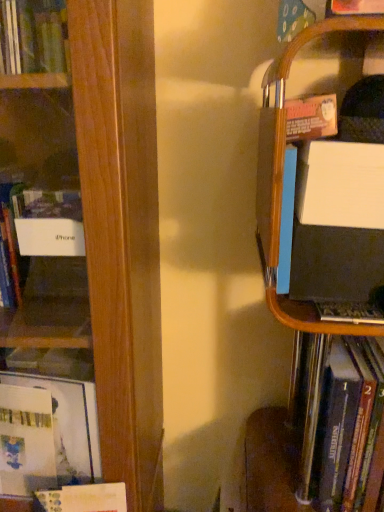
The width and height of the screenshot is (384, 512). I want to click on wooden bookshelf at left, which ranks as the 3th book in right-to-left order, so click(98, 229).

Between black matte laptop at right, which is counted as the first book, starting from the right, and white paper at lower left, the second book viewed from the left, which one has smaller size?

white paper at lower left, the second book viewed from the left.

In the image, there is a black matte laptop at right, acting as the 3th book starting from the left. Where is `book below it (from a real-world perspective)`? The width and height of the screenshot is (384, 512). book below it (from a real-world perspective) is located at coordinates (83, 498).

Is wooden bookshelf at left, which ranks as the 3th book in right-to-left order, wider or thinner than white paper at lower left, the second book viewed from the right?

In the image, wooden bookshelf at left, which ranks as the 3th book in right-to-left order, appears to be wider than white paper at lower left, the second book viewed from the right.

Is wooden bookshelf at left, which ranks as the 3th book in right-to-left order, closer to camera compared to white paper at lower left, the second book viewed from the right?

Yes, wooden bookshelf at left, which ranks as the 3th book in right-to-left order, is in front of white paper at lower left, the second book viewed from the right.

From the image's perspective, is wooden bookshelf at left, which ranks as the first book in left-to-right order, positioned above or below white paper at lower left, the second book viewed from the left?

Clearly, from the image's perspective, wooden bookshelf at left, which ranks as the first book in left-to-right order, is above white paper at lower left, the second book viewed from the left.

In terms of size, does wooden bookshelf at left, which ranks as the 3th book in right-to-left order, appear bigger or smaller than white paper at lower left, the second book viewed from the right?

Clearly, wooden bookshelf at left, which ranks as the 3th book in right-to-left order, is larger in size than white paper at lower left, the second book viewed from the right.

Between point (120, 483) and point (301, 463), which one is positioned behind?

The point (301, 463) is farther from the camera.

Is white paper at lower left, the second book viewed from the right, touching matte black laptop at right?

No, white paper at lower left, the second book viewed from the right, is not in contact with matte black laptop at right.

Is white paper at lower left, the second book viewed from the right, spatially inside matte black laptop at right, or outside of it?

white paper at lower left, the second book viewed from the right, lies outside matte black laptop at right.

Which book is the 1st one when counting from the left side of the black matte laptop at right, acting as the 3th book starting from the left? Please provide its 2D coordinates.

[(83, 498)]

Consider the image. Which object is further away from the camera taking this photo, white paper at lower left, the second book viewed from the left, or black matte laptop at right, which is counted as the first book, starting from the right?

white paper at lower left, the second book viewed from the left, is behind.

Does white paper at lower left, the second book viewed from the right, have a greater height compared to black matte laptop at right, which is counted as the first book, starting from the right?

Incorrect, the height of white paper at lower left, the second book viewed from the right, is not larger of that of black matte laptop at right, which is counted as the first book, starting from the right.

Is wooden bookshelf at left, which ranks as the first book in left-to-right order, positioned beyond the bounds of black matte laptop at right, acting as the 3th book starting from the left?

Yes, wooden bookshelf at left, which ranks as the first book in left-to-right order, is located beyond the bounds of black matte laptop at right, acting as the 3th book starting from the left.

Does wooden bookshelf at left, which ranks as the 3th book in right-to-left order, touch black matte laptop at right, acting as the 3th book starting from the left?

There is a gap between wooden bookshelf at left, which ranks as the 3th book in right-to-left order, and black matte laptop at right, acting as the 3th book starting from the left.

Which object is wider, wooden bookshelf at left, which ranks as the first book in left-to-right order, or black matte laptop at right, acting as the 3th book starting from the left?

wooden bookshelf at left, which ranks as the first book in left-to-right order.

Find the location of a particular element. This screenshot has width=384, height=512. book above the black matte laptop at right, which is counted as the first book, starting from the right (from the image's perspective) is located at coordinates click(x=98, y=229).

Which object is positioned more to the left, wooden bookshelf at left, which ranks as the first book in left-to-right order, or matte black laptop at right?

wooden bookshelf at left, which ranks as the first book in left-to-right order.

From a real-world perspective, which is physically above, wooden bookshelf at left, which ranks as the 3th book in right-to-left order, or matte black laptop at right?

wooden bookshelf at left, which ranks as the 3th book in right-to-left order, is physically above.

Is wooden bookshelf at left, which ranks as the 3th book in right-to-left order, facing away from matte black laptop at right?

wooden bookshelf at left, which ranks as the 3th book in right-to-left order, does not have its back to matte black laptop at right.

Is point (136, 421) closer or farther from the camera than point (280, 202)?

Point (136, 421) is positioned farther from the camera compared to point (280, 202).

Are black matte laptop at right, acting as the 3th book starting from the left, and wooden bookshelf at left, which ranks as the first book in left-to-right order, making contact?

black matte laptop at right, acting as the 3th book starting from the left, and wooden bookshelf at left, which ranks as the first book in left-to-right order, are clearly separated.

Does black matte laptop at right, which is counted as the first book, starting from the right, lie behind wooden bookshelf at left, which ranks as the 3th book in right-to-left order?

Yes, black matte laptop at right, which is counted as the first book, starting from the right, is further from the viewer.

Considering the relative positions of black matte laptop at right, which is counted as the first book, starting from the right, and wooden bookshelf at left, which ranks as the 3th book in right-to-left order, in the image provided, is black matte laptop at right, which is counted as the first book, starting from the right, to the right of wooden bookshelf at left, which ranks as the 3th book in right-to-left order, from the viewer's perspective?

Indeed, black matte laptop at right, which is counted as the first book, starting from the right, is positioned on the right side of wooden bookshelf at left, which ranks as the 3th book in right-to-left order.

Can you confirm if black matte laptop at right, acting as the 3th book starting from the left, is shorter than wooden bookshelf at left, which ranks as the 3th book in right-to-left order?

Indeed, black matte laptop at right, acting as the 3th book starting from the left, has a lesser height compared to wooden bookshelf at left, which ranks as the 3th book in right-to-left order.

Locate an element on the screen. The width and height of the screenshot is (384, 512). book beneath the black matte laptop at right, which is counted as the first book, starting from the right (from a real-world perspective) is located at coordinates [83, 498].

What are the coordinates of `the 1st book to the right of the wooden bookshelf at left, which ranks as the 3th book in right-to-left order, counting from the anchor's position` in the screenshot? It's located at (83, 498).

Based on their spatial positions, is white paper at lower left, the second book viewed from the right, or matte black laptop at right further from black matte laptop at right, acting as the 3th book starting from the left?

Among the two, white paper at lower left, the second book viewed from the right, is located further to black matte laptop at right, acting as the 3th book starting from the left.

Looking at the image, which one is located further to wooden bookshelf at left, which ranks as the 3th book in right-to-left order, matte black laptop at right or black matte laptop at right, acting as the 3th book starting from the left?

black matte laptop at right, acting as the 3th book starting from the left, lies further to wooden bookshelf at left, which ranks as the 3th book in right-to-left order, than the other object.

Which object lies nearer to the anchor point wooden bookshelf at left, which ranks as the first book in left-to-right order, matte black laptop at right or white paper at lower left, the second book viewed from the left?

matte black laptop at right.

When comparing their distances from matte black laptop at right, does wooden bookshelf at left, which ranks as the first book in left-to-right order, or black matte laptop at right, which is counted as the first book, starting from the right, seem closer?

black matte laptop at right, which is counted as the first book, starting from the right, is positioned closer to the anchor matte black laptop at right.

Based on their spatial positions, is white paper at lower left, the second book viewed from the left, or wooden bookshelf at left, which ranks as the 3th book in right-to-left order, closer to matte black laptop at right?

wooden bookshelf at left, which ranks as the 3th book in right-to-left order.

Looking at this image, when comparing their distances from wooden bookshelf at left, which ranks as the 3th book in right-to-left order, does black matte laptop at right, which is counted as the first book, starting from the right, or white paper at lower left, the second book viewed from the left, seem closer?

Based on the image, white paper at lower left, the second book viewed from the left, appears to be nearer to wooden bookshelf at left, which ranks as the 3th book in right-to-left order.

Looking at this image, looking at the image, which one is located further to black matte laptop at right, acting as the 3th book starting from the left, white paper at lower left, the second book viewed from the right, or wooden bookshelf at left, which ranks as the first book in left-to-right order?

Among the two, wooden bookshelf at left, which ranks as the first book in left-to-right order, is located further to black matte laptop at right, acting as the 3th book starting from the left.

Which object lies nearer to the anchor point black matte laptop at right, which is counted as the first book, starting from the right, wooden bookshelf at left, which ranks as the first book in left-to-right order, or matte black laptop at right?

Based on the image, matte black laptop at right appears to be nearer to black matte laptop at right, which is counted as the first book, starting from the right.

At what (x,y) coordinates should I click in order to perform the action: click on book situated between wooden bookshelf at left, which ranks as the 3th book in right-to-left order, and black matte laptop at right, acting as the 3th book starting from the left, from left to right. Please return your answer as a coordinate pair (x, y). This screenshot has width=384, height=512. Looking at the image, I should click on (83, 498).

Identify the location of bookshelf located between white paper at lower left, the second book viewed from the right, and black matte laptop at right, which is counted as the first book, starting from the right, in the left-right direction. (280, 224).

Find the location of a particular element. This screenshot has height=512, width=384. book between wooden bookshelf at left, which ranks as the first book in left-to-right order, and matte black laptop at right, in the horizontal direction is located at coordinates (83, 498).

At what (x,y) coordinates should I click in order to perform the action: click on bookshelf located between wooden bookshelf at left, which ranks as the 3th book in right-to-left order, and black matte laptop at right, acting as the 3th book starting from the left, in the left-right direction. Please return your answer as a coordinate pair (x, y). Looking at the image, I should click on (280, 224).